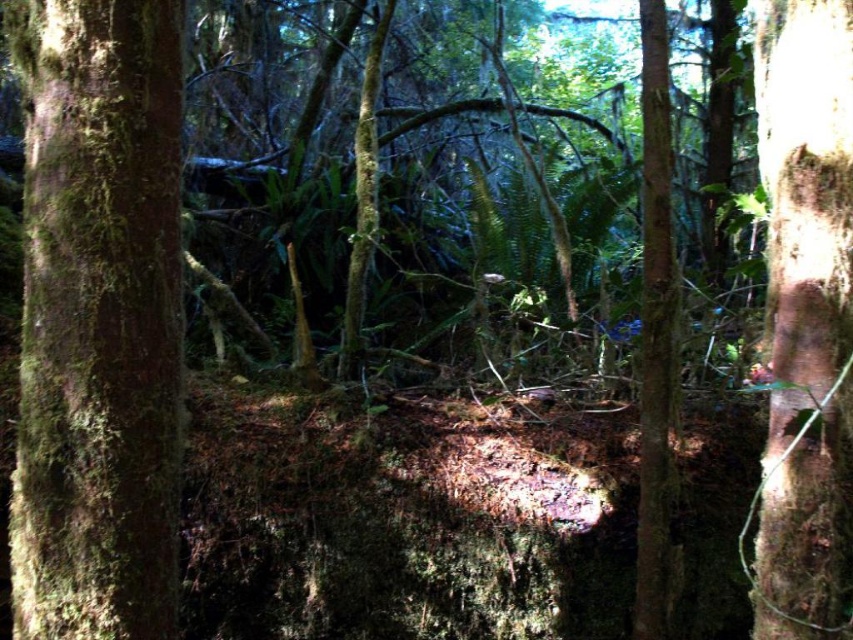
Is brown rough bark tree trunk at right to the left of smooth bark tree trunk at center from the viewer's perspective?

Incorrect, brown rough bark tree trunk at right is not on the left side of smooth bark tree trunk at center.

Is the position of brown rough bark tree trunk at right more distant than that of smooth bark tree trunk at center?

No, it is not.

Which is behind, point (788, 348) or point (664, 536)?

The point (664, 536) is more distant.

Locate an element on the screen. brown rough bark tree trunk at right is located at coordinates (804, 308).

Is the position of green mossy tree trunk at left more distant than that of brown rough bark tree trunk at right?

Yes, green mossy tree trunk at left is behind brown rough bark tree trunk at right.

In the scene shown: Is green mossy tree trunk at left bigger than brown rough bark tree trunk at right?

Yes, green mossy tree trunk at left is bigger than brown rough bark tree trunk at right.

Identify the location of green mossy tree trunk at left. (97, 321).

Which is above, green mossy tree trunk at left or smooth bark tree trunk at center?

smooth bark tree trunk at center is above.

The height and width of the screenshot is (640, 853). I want to click on green mossy tree trunk at left, so click(x=97, y=321).